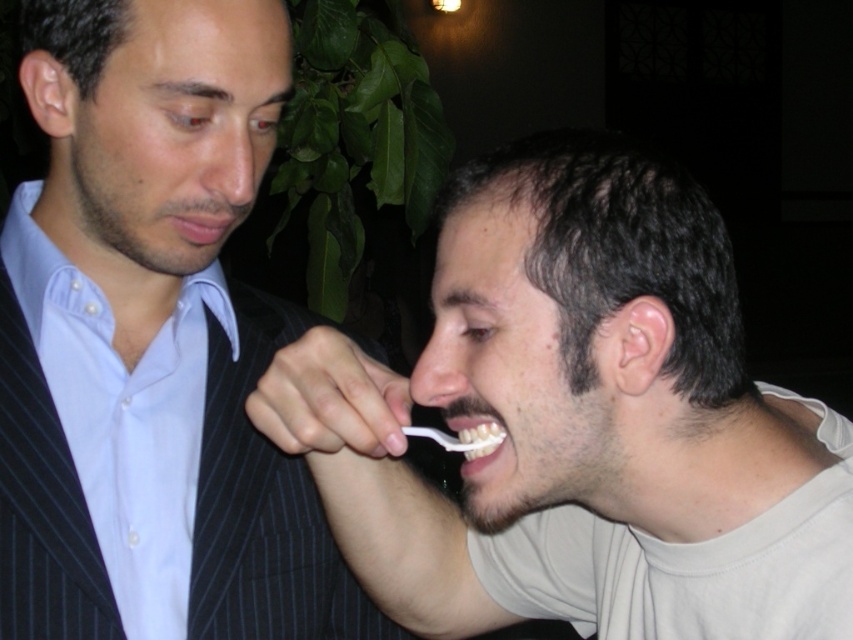
You are a dentist who needs to recommend a toothbrush to a patient. You see the white matte toothbrush at upper left and the white glossy toothbrush at lower center in the image. Which one is positioned to the left?

The white matte toothbrush at upper left is positioned to the left of the white glossy toothbrush at lower center.

You are a dentist examining a patient in an office. You see a white glossy toothbrush at lower center and a white plastic toothbrush at lower center. Which toothbrush is positioned higher in the image?

The white glossy toothbrush at lower center is located above the white plastic toothbrush at lower center, so it is positioned higher in the image.